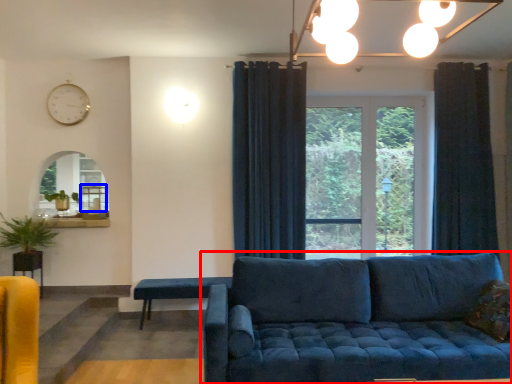
Question: Among these objects, which one is farthest to the camera, studio couch (highlighted by a red box) or table (highlighted by a blue box)?

Choices:
 (A) studio couch
 (B) table

Answer: (B)